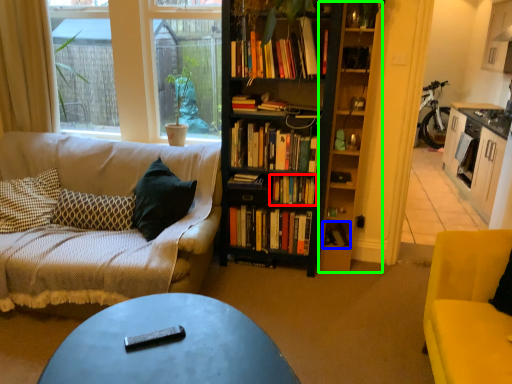
Question: Which is nearer to the book (highlighted by a red box)? book (highlighted by a blue box) or shelf (highlighted by a green box).

Choices:
 (A) book
 (B) shelf

Answer: (B)